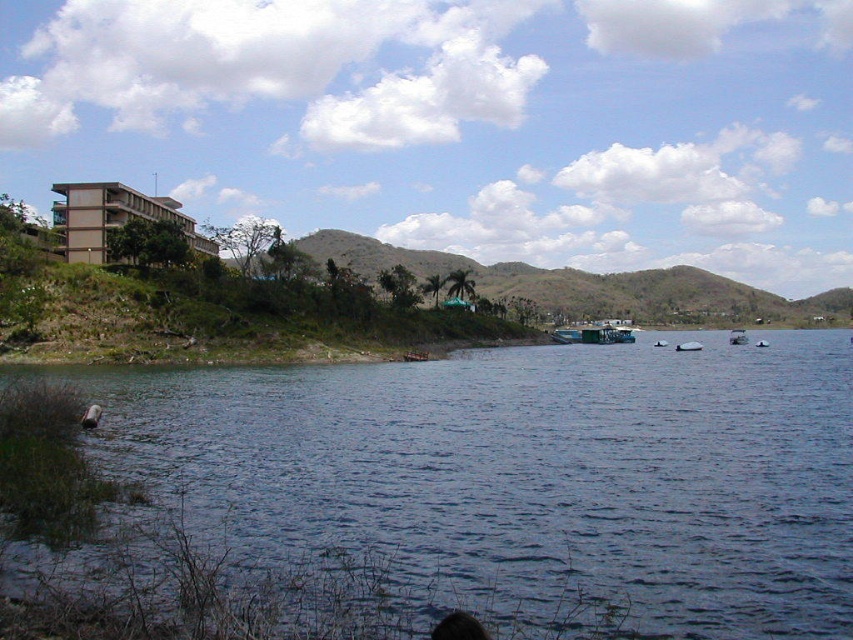
Question: Which is nearer to the white plastic boat at center?

Choices:
 (A) green leafy hillside at center
 (B) green matte boat at center

Answer: (B)

Question: Is green matte boat at center further to the viewer compared to white plastic boat at center?

Choices:
 (A) yes
 (B) no

Answer: (A)

Question: Which of the following is the farthest from the observer?

Choices:
 (A) blue water at center
 (B) white plastic boat at center
 (C) green matte boat at center
 (D) green leafy hillside at center

Answer: (C)

Question: Is green leafy hillside at center wider than green matte boat at center?

Choices:
 (A) no
 (B) yes

Answer: (B)

Question: Does blue water at center have a greater width compared to white plastic boat at center?

Choices:
 (A) yes
 (B) no

Answer: (A)

Question: Which of the following is the farthest from the observer?

Choices:
 (A) (694, 349)
 (B) (622, 461)
 (C) (302, 240)

Answer: (C)